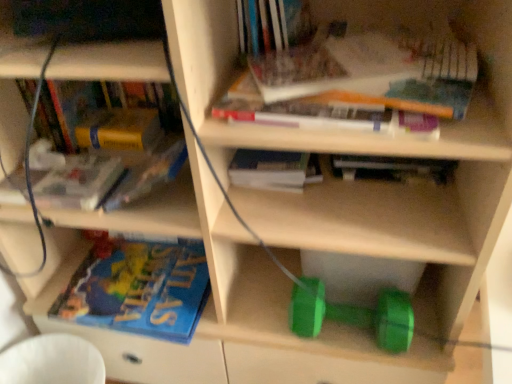
Question: Is yellow matte paperback book at upper left shorter than green rubber dumbbell at lower center?

Choices:
 (A) yes
 (B) no

Answer: (A)

Question: Would you say green rubber dumbbell at lower center is part of yellow matte paperback book at upper left's contents?

Choices:
 (A) yes
 (B) no

Answer: (B)

Question: From the image's perspective, is yellow matte paperback book at upper left located above green rubber dumbbell at lower center?

Choices:
 (A) yes
 (B) no

Answer: (A)

Question: Does yellow matte paperback book at upper left lie behind green rubber dumbbell at lower center?

Choices:
 (A) no
 (B) yes

Answer: (B)

Question: Is yellow matte paperback book at upper left touching green rubber dumbbell at lower center?

Choices:
 (A) no
 (B) yes

Answer: (A)

Question: From the image's perspective, does yellow matte paperback book at upper left appear lower than green rubber dumbbell at lower center?

Choices:
 (A) yes
 (B) no

Answer: (B)

Question: Can you confirm if white plastic swivel chair at lower left is taller than hardcover book at center, which ranks as the third book in top-to-bottom order?

Choices:
 (A) yes
 (B) no

Answer: (A)

Question: From a real-world perspective, is white plastic swivel chair at lower left on hardcover book at center, which ranks as the third book in top-to-bottom order?

Choices:
 (A) yes
 (B) no

Answer: (B)

Question: Does white plastic swivel chair at lower left have a lesser height compared to hardcover book at center, which ranks as the third book in top-to-bottom order?

Choices:
 (A) no
 (B) yes

Answer: (A)

Question: Is white plastic swivel chair at lower left placed right next to hardcover book at center, which ranks as the third book in top-to-bottom order?

Choices:
 (A) no
 (B) yes

Answer: (A)

Question: Is white plastic swivel chair at lower left far from hardcover book at center, which ranks as the third book in top-to-bottom order?

Choices:
 (A) yes
 (B) no

Answer: (B)

Question: Is white plastic swivel chair at lower left positioned with its back to hardcover book at center, which is counted as the 5th book, starting from the bottom?

Choices:
 (A) no
 (B) yes

Answer: (A)

Question: Could you tell me if hardcover book at upper center, placed as the 1th book when sorted from top to bottom, is facing yellow matte paperback book at upper left?

Choices:
 (A) yes
 (B) no

Answer: (B)